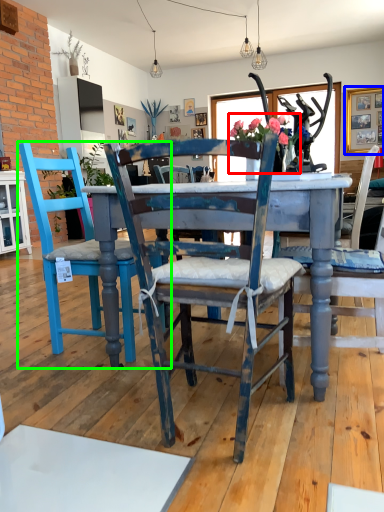
Question: Which object is the farthest from floral arrangement (highlighted by a red box)? Choose among these: picture frame (highlighted by a blue box) or chair (highlighted by a green box).

Choices:
 (A) picture frame
 (B) chair

Answer: (A)